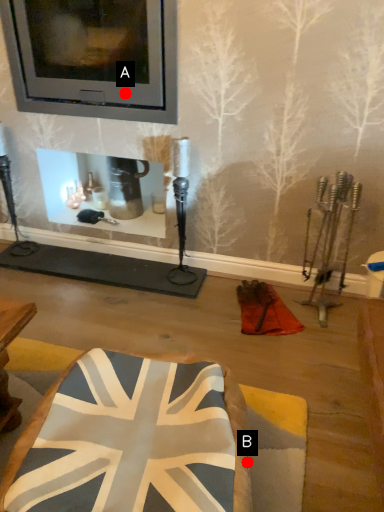
Question: Two points are circled on the image, labeled by A and B beside each circle. Among these points, which one is nearest to the camera?

Choices:
 (A) A is closer
 (B) B is closer

Answer: (B)